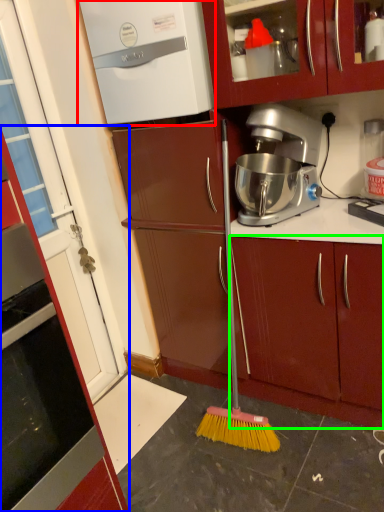
Question: Considering the real-world distances, which object is closest to home appliance (highlighted by a red box)? cabinetry (highlighted by a blue box) or cabinetry (highlighted by a green box).

Choices:
 (A) cabinetry
 (B) cabinetry

Answer: (B)